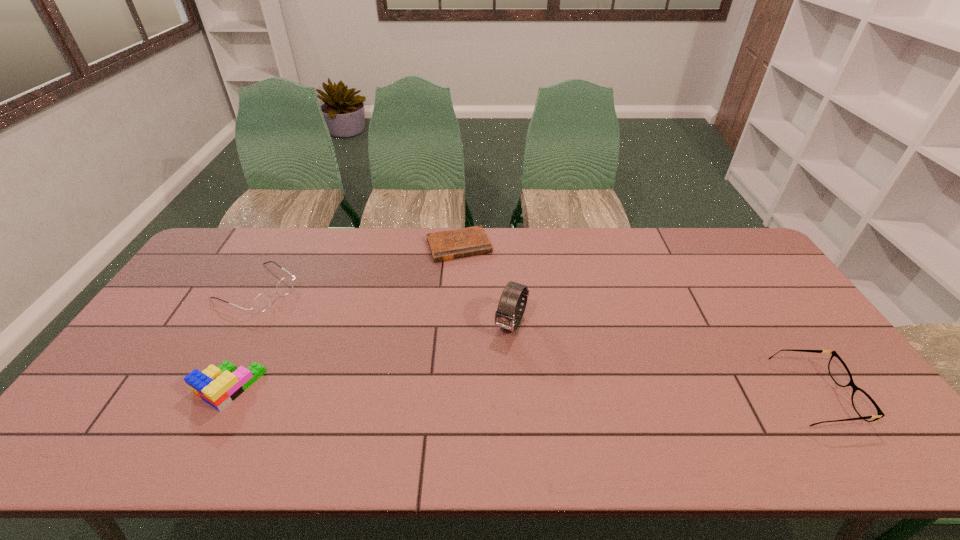
Locate an element on the screen. vacant space located 0.150m through the lenses of the left spectacles is located at coordinates (318, 323).

What are the coordinates of `free spot located on the face of the watch` in the screenshot? It's located at (466, 416).

Locate an element on the screen. Image resolution: width=960 pixels, height=540 pixels. free spot located on the face of the watch is located at coordinates (490, 370).

Where is `free spot located on the face of the watch`? This screenshot has width=960, height=540. free spot located on the face of the watch is located at coordinates (470, 406).

You are a GUI agent. You are given a task and a screenshot of the screen. Output one action in this format:
    pyautogui.click(x=<x>, y=<y>)
    Task: Click on the vacant space located 0.350m on the spine side of the diary
    This screenshot has width=960, height=540.
    Given the screenshot: What is the action you would take?
    pyautogui.click(x=497, y=338)

You are a GUI agent. You are given a task and a screenshot of the screen. Output one action in this format:
    pyautogui.click(x=<x>, y=<y>)
    Task: Click on the vacant space located on the spine side of the diary
    This screenshot has width=960, height=540.
    Given the screenshot: What is the action you would take?
    pyautogui.click(x=487, y=311)

The height and width of the screenshot is (540, 960). Find the location of `vacant space located on the spine side of the diary`. vacant space located on the spine side of the diary is located at coordinates tap(484, 305).

Where is `spectacles located in the far edge section of the desktop`? spectacles located in the far edge section of the desktop is located at coordinates (262, 301).

The width and height of the screenshot is (960, 540). Find the location of `diary located in the far edge section of the desktop`. diary located in the far edge section of the desktop is located at coordinates (446, 245).

Locate an element on the screen. The height and width of the screenshot is (540, 960). Lego that is at the near edge is located at coordinates coord(218,386).